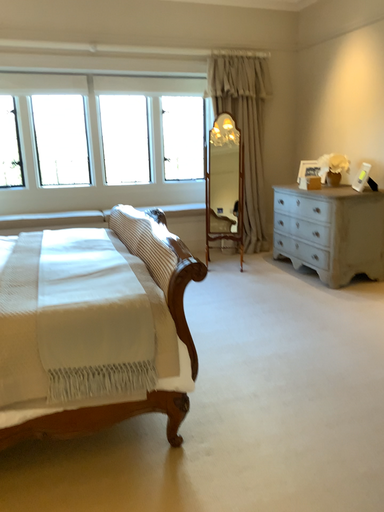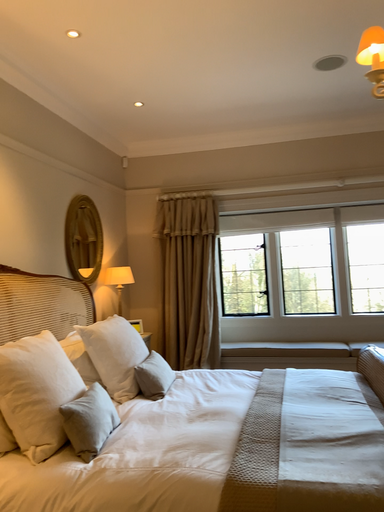
Question: Which way did the camera rotate in the video?

Choices:
 (A) rotated right
 (B) rotated left

Answer: (B)